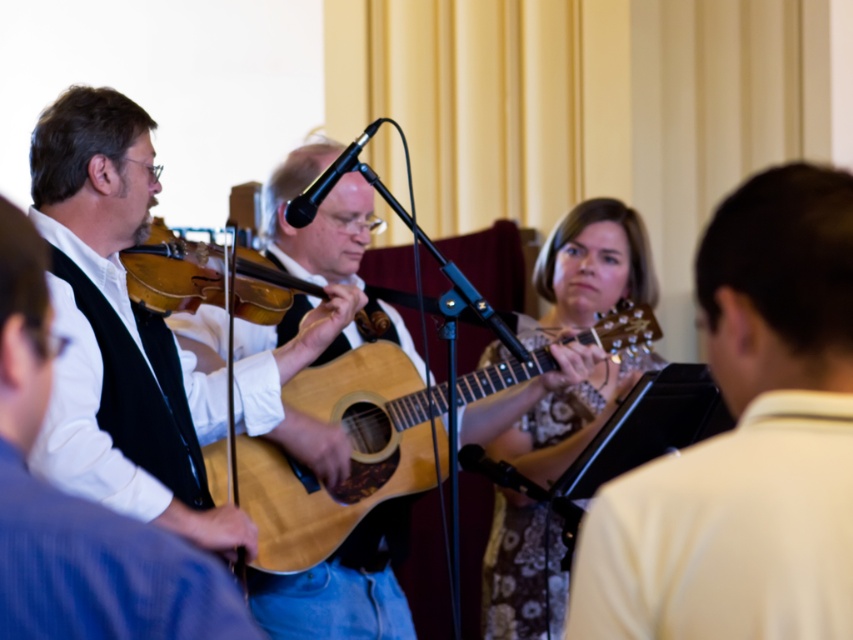
Is light brown wood guitar at center in front of light brown acoustic guitar at center?

Yes, light brown wood guitar at center is in front of light brown acoustic guitar at center.

Does light brown wood guitar at center appear over light brown acoustic guitar at center?

Indeed, light brown wood guitar at center is positioned over light brown acoustic guitar at center.

Is point (728, 317) positioned before point (531, 360)?

Yes, it is in front of point (531, 360).

Where is `light brown wood guitar at center`? The image size is (853, 640). light brown wood guitar at center is located at coordinates 746,442.

Is light brown acoustic guitar at center above wooden violin at center?

Actually, light brown acoustic guitar at center is below wooden violin at center.

Who is more distant from viewer, [405,435] or [294,330]?

The point [405,435] is more distant.

Is point (602, 324) closer to viewer compared to point (239, 292)?

No, it is not.

Image resolution: width=853 pixels, height=640 pixels. I want to click on light brown acoustic guitar at center, so click(350, 454).

Is point (27, 618) positioned before point (202, 301)?

Yes.

Can you confirm if matte black violin at left is smaller than wooden violin at center?

Correct, matte black violin at left occupies less space than wooden violin at center.

Which is in front, point (4, 500) or point (167, 282)?

Positioned in front is point (4, 500).

Locate an element on the screen. This screenshot has height=640, width=853. matte black violin at left is located at coordinates (80, 508).